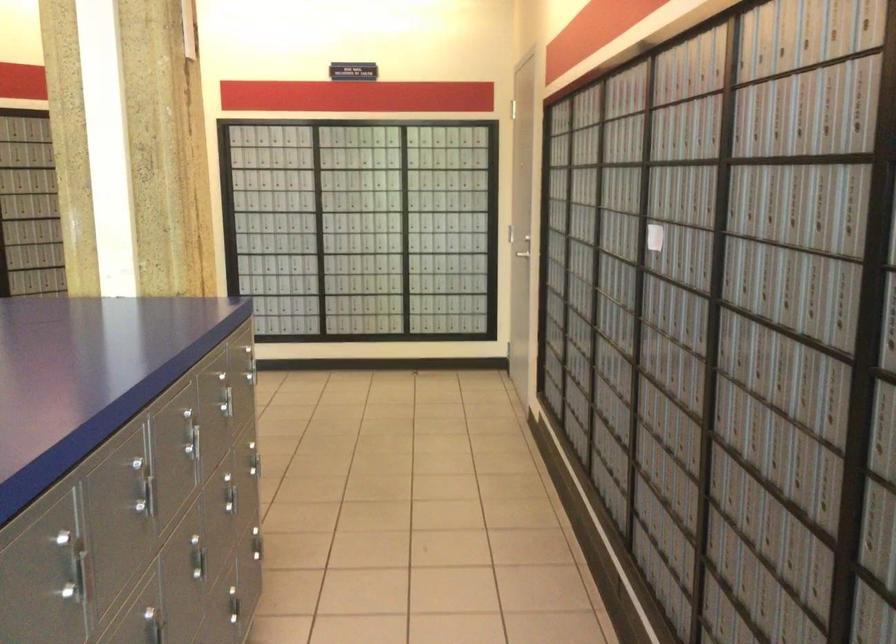
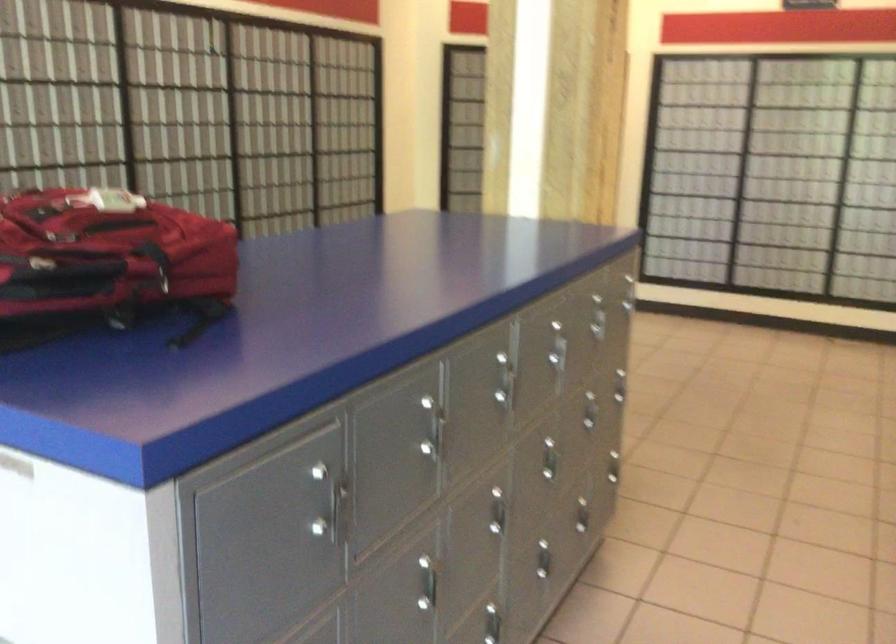
In the second image, find the point that corresponds to [90,558] in the first image.

(444, 431)